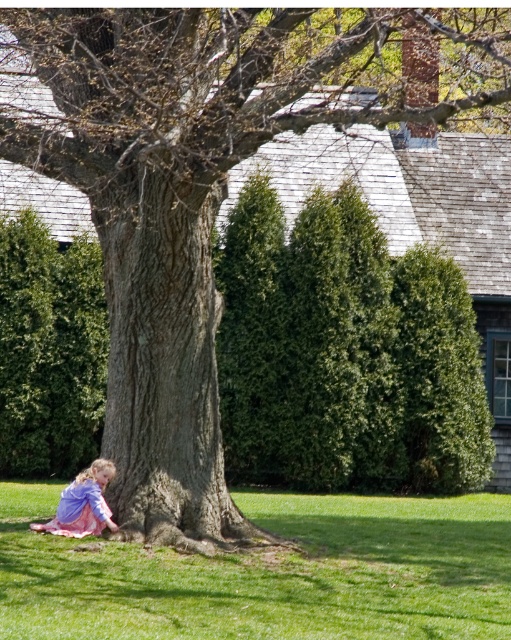
Does green grass at lower left appear over pink satin dress at lower left?

No.

Does green grass at lower left have a smaller size compared to pink satin dress at lower left?

Actually, green grass at lower left might be larger than pink satin dress at lower left.

Between point (290, 560) and point (75, 499), which one is positioned in front?

Point (290, 560) is more forward.

The width and height of the screenshot is (511, 640). Identify the location of green grass at lower left. (269, 573).